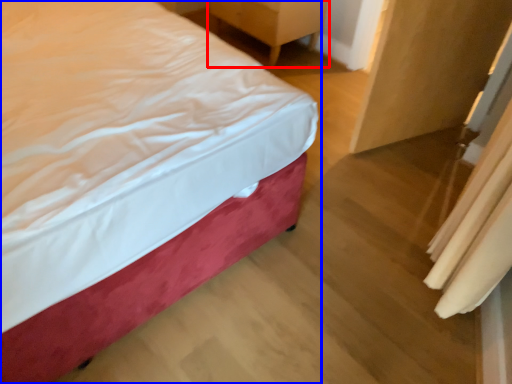
Question: Which point is further to the camera, furniture (highlighted by a red box) or bed (highlighted by a blue box)?

Choices:
 (A) furniture
 (B) bed

Answer: (A)